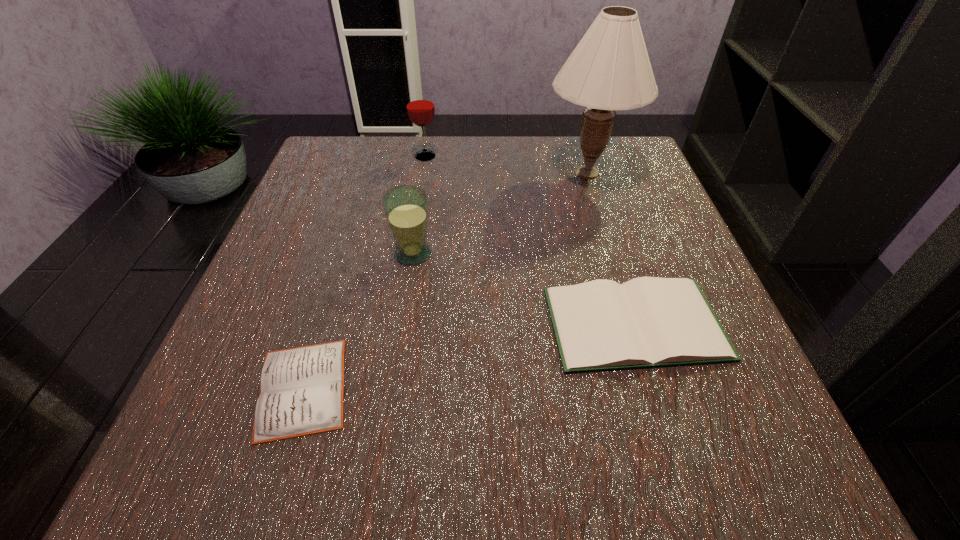
This screenshot has width=960, height=540. I want to click on object present at the far right corner, so click(x=609, y=70).

Locate an element on the screen. vacant space at the far edge of the desktop is located at coordinates (460, 156).

You are a GUI agent. You are given a task and a screenshot of the screen. Output one action in this format:
    pyautogui.click(x=<x>, y=<y>)
    Task: Click on the vacant space at the near edge of the desktop
    The width and height of the screenshot is (960, 540).
    Given the screenshot: What is the action you would take?
    pyautogui.click(x=402, y=463)

At what (x,y) coordinates should I click in order to perform the action: click on free location at the left edge of the desktop. Please return your answer as a coordinate pair (x, y). Looking at the image, I should click on (253, 345).

This screenshot has height=540, width=960. What are the coordinates of `vacant area at the right edge of the desktop` in the screenshot? It's located at (720, 382).

The image size is (960, 540). What are the coordinates of `vacant space at the far left corner` in the screenshot? It's located at (304, 189).

What are the coordinates of `vacant region at the near left corner of the desktop` in the screenshot? It's located at (246, 476).

Find the location of a particular element. vacant area between the hardback book and the tallest object is located at coordinates (612, 248).

The height and width of the screenshot is (540, 960). Find the location of `empty space that is in between the third tallest object and the diary`. empty space that is in between the third tallest object and the diary is located at coordinates (358, 321).

This screenshot has width=960, height=540. Find the location of `blank region between the fourth tallest object and the fourth shortest object`. blank region between the fourth tallest object and the fourth shortest object is located at coordinates (530, 240).